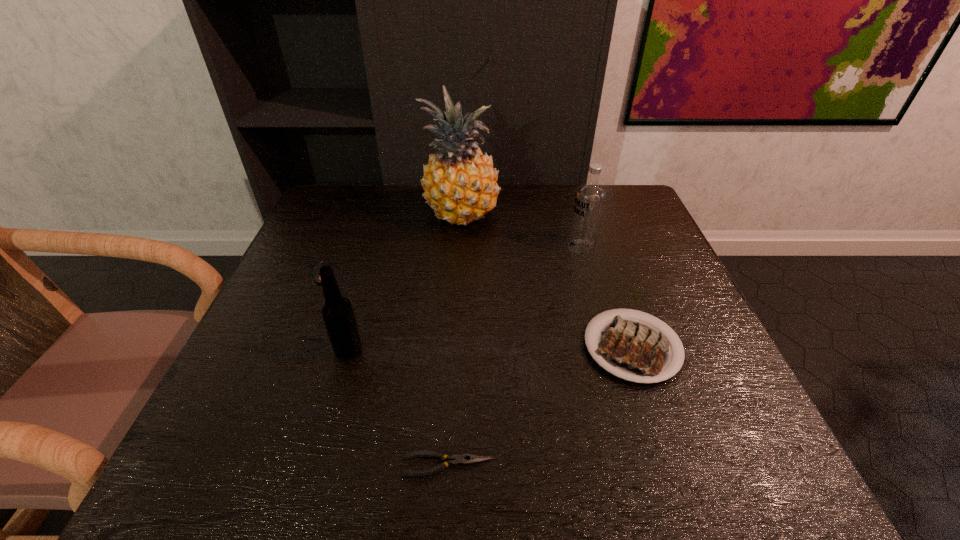
This screenshot has height=540, width=960. Identify the location of the farthest object. (460, 183).

The height and width of the screenshot is (540, 960). I want to click on pineapple, so click(460, 183).

Locate an element on the screen. This screenshot has height=540, width=960. the second farthest object is located at coordinates (589, 201).

You are a GUI agent. You are given a task and a screenshot of the screen. Output one action in this format:
    pyautogui.click(x=<x>, y=<y>)
    Task: Click on the beer bottle
    This screenshot has height=540, width=960.
    Given the screenshot: What is the action you would take?
    pyautogui.click(x=337, y=312)

Locate an element on the screen. The image size is (960, 540). plate is located at coordinates (631, 349).

The image size is (960, 540). Find the location of `computer mouse`. computer mouse is located at coordinates (316, 276).

Where is `the third farthest object`? The image size is (960, 540). the third farthest object is located at coordinates (316, 276).

Where is `the shortest object`? The height and width of the screenshot is (540, 960). the shortest object is located at coordinates (462, 459).

Where is `pliers`? pliers is located at coordinates click(x=462, y=459).

Where is `vacant space located 0.060m on the left of the farthest object`? This screenshot has height=540, width=960. vacant space located 0.060m on the left of the farthest object is located at coordinates (402, 215).